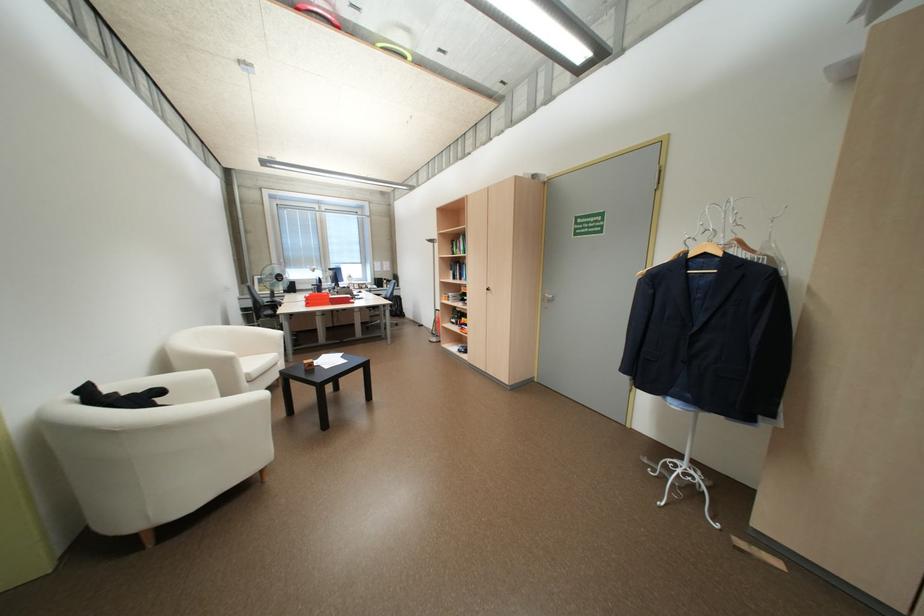
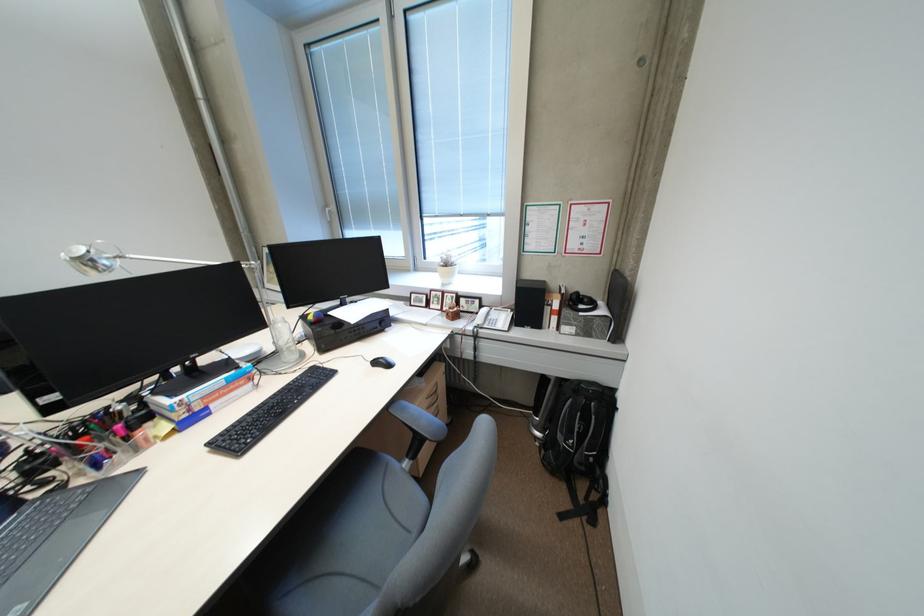
Locate, in the second image, the point that corresponds to pixel 388 282 in the first image.

(538, 302)